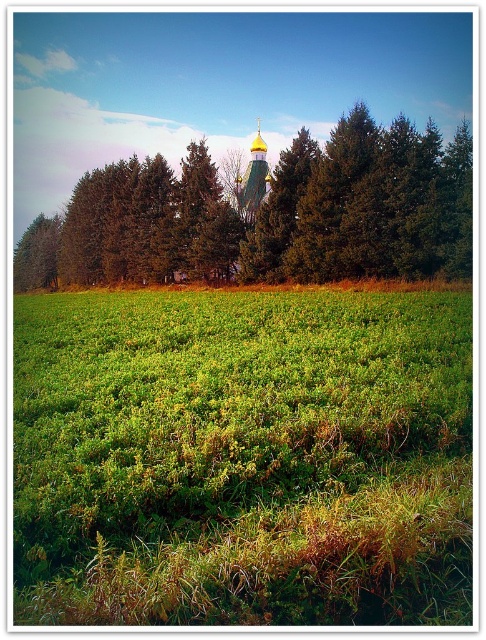
This screenshot has width=486, height=640. What do you see at coordinates (240, 456) in the screenshot?
I see `green grassy field at center` at bounding box center [240, 456].

Does green grassy field at center come behind gold domed church at center?

No, it is in front of gold domed church at center.

Which is behind, point (323, 512) or point (242, 176)?

The point (242, 176) is more distant.

The width and height of the screenshot is (486, 640). Find the location of `green grassy field at center`. green grassy field at center is located at coordinates tap(240, 456).

Between green leafy tree at center and gold domed church at center, which one has less height?

green leafy tree at center

Is point (40, 259) in front of point (250, 173)?

No.

What do you see at coordinates (268, 214) in the screenshot? I see `green leafy tree at center` at bounding box center [268, 214].

This screenshot has width=486, height=640. Identify the location of green leafy tree at center. (268, 214).

Who is positioned more to the right, green grassy field at center or green leafy tree at center?

green grassy field at center is more to the right.

Can you confirm if green grassy field at center is wider than green leafy tree at center?

No, green grassy field at center is not wider than green leafy tree at center.

Find the location of `green grassy field at center`. green grassy field at center is located at coordinates (240, 456).